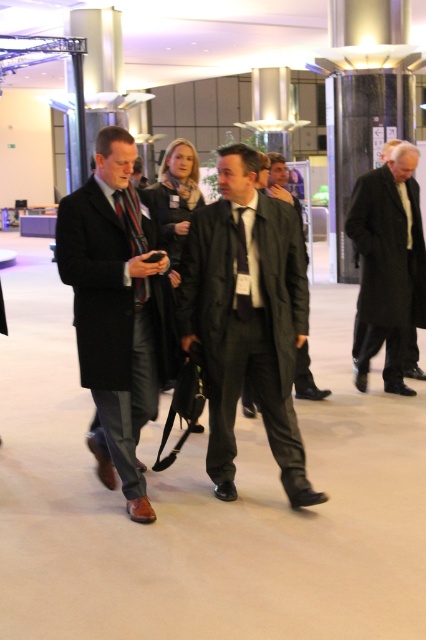
Which is above, matte black coat at center or black wool coat at right?

Positioned higher is black wool coat at right.

Is matte black coat at center wider than black wool coat at right?

Incorrect, matte black coat at center's width does not surpass black wool coat at right's.

Is point (83, 323) behind point (417, 160)?

No, (83, 323) is in front of (417, 160).

This screenshot has width=426, height=640. In order to click on matte black coat at center in this screenshot , I will do `click(115, 310)`.

Is matte black coat at center positioned before black silk tie at center?

That is True.

Is matte black coat at center below black silk tie at center?

Correct, matte black coat at center is located below black silk tie at center.

You are a GUI agent. You are given a task and a screenshot of the screen. Output one action in this format:
    pyautogui.click(x=<x>, y=<y>)
    Task: Click on the matte black coat at center
    The width and height of the screenshot is (426, 640).
    Given the screenshot: What is the action you would take?
    pyautogui.click(x=115, y=310)

Measure the distance between matte black suit at center and black silk tie at center.

The distance of matte black suit at center from black silk tie at center is 13.73 inches.

Is point (264, 278) farther from camera compared to point (239, 244)?

No, (264, 278) is closer to viewer.

What do you see at coordinates (249, 320) in the screenshot? I see `matte black suit at center` at bounding box center [249, 320].

I want to click on matte black suit at center, so click(249, 320).